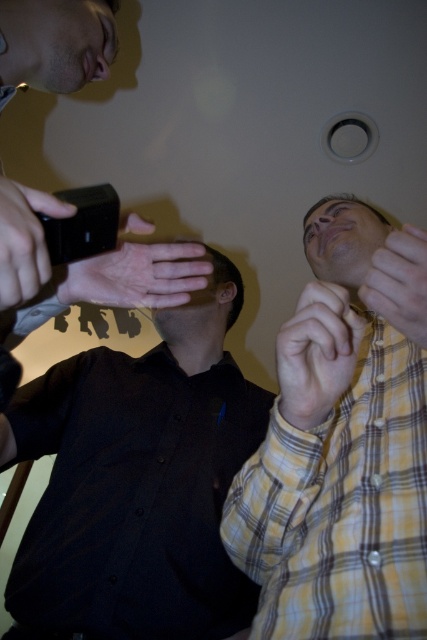
The height and width of the screenshot is (640, 427). In order to click on black matte shirt at left in this screenshot , I will do `click(137, 483)`.

Does black matte shirt at left lie in front of black matte phone at upper left?

No, black matte shirt at left is further to the viewer.

This screenshot has width=427, height=640. What are the coordinates of `black matte shirt at left` in the screenshot? It's located at (137, 483).

Between point (366, 349) and point (149, 256), which one is positioned in front?

Point (149, 256) is more forward.

Is point (379, 396) farther from viewer compared to point (28, 278)?

Yes.

The image size is (427, 640). Describe the element at coordinates (341, 506) in the screenshot. I see `yellow plaid shirt at lower right` at that location.

Locate an element on the screen. The width and height of the screenshot is (427, 640). yellow plaid shirt at lower right is located at coordinates (341, 506).

Between point (76, 468) and point (307, 468), which one is positioned in front?

Point (307, 468)

What do you see at coordinates (137, 483) in the screenshot? I see `black matte shirt at left` at bounding box center [137, 483].

You are a GUI agent. You are given a task and a screenshot of the screen. Output one action in this format:
    pyautogui.click(x=<x>, y=<y>)
    Task: Click on the black matte shirt at left
    
    Given the screenshot: What is the action you would take?
    pyautogui.click(x=137, y=483)

At what (x,y) coordinates should I click in order to perform the action: click on black matte shirt at left. Please return your answer as a coordinate pair (x, y). This screenshot has width=427, height=640. Looking at the image, I should click on (137, 483).